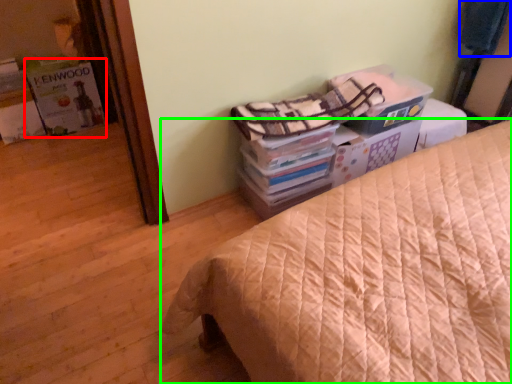
Question: Considering the real-world distances, which object is farthest from magazine (highlighted by a red box)? blanket (highlighted by a blue box) or bed (highlighted by a green box)?

Choices:
 (A) blanket
 (B) bed

Answer: (A)